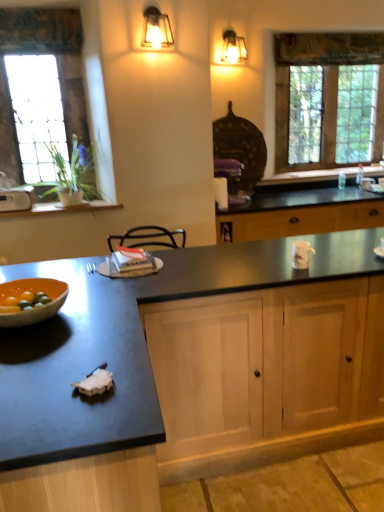
Locate an element on the screen. vacant region to the left of white crumbly food at center is located at coordinates (39, 386).